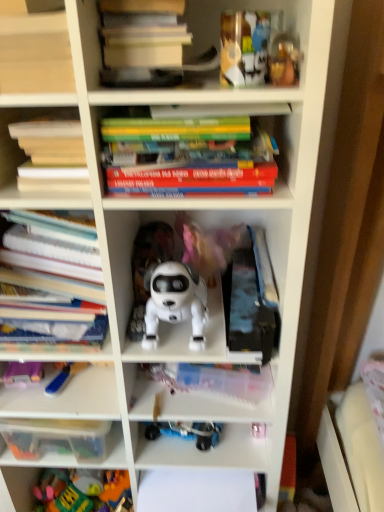
This screenshot has width=384, height=512. Find the location of `hardcover books at upper center, the first book from the top`. hardcover books at upper center, the first book from the top is located at coordinates (142, 42).

What do you see at coordinates (49, 271) in the screenshot? I see `white paper at left, which is the first book in bottom-to-top order` at bounding box center [49, 271].

How much space does white matte robot dog at center, which appears as the 2th toy when viewed from the front, occupy horizontally?

white matte robot dog at center, which appears as the 2th toy when viewed from the front, is 10.27 inches in width.

The image size is (384, 512). Find the location of `clear plastic container at lower left`. clear plastic container at lower left is located at coordinates (66, 398).

Find the location of a particular element. hardcover books at center, the 2th book viewed from the top is located at coordinates (193, 167).

Is clear plastic container at lower left facing towards hardcover books at center, the 2th book viewed from the top?

No, clear plastic container at lower left is not turned towards hardcover books at center, the 2th book viewed from the top.

Are clear plastic container at lower left and hardcover books at center, the 2th book viewed from the top, far apart?

No, clear plastic container at lower left is not far away from hardcover books at center, the 2th book viewed from the top.

From a real-world perspective, relative to hardcover books at center, marked as the third book in a bottom-to-top arrangement, is clear plastic container at lower left vertically above or below?

In terms of real-world spatial position, clear plastic container at lower left is below hardcover books at center, marked as the third book in a bottom-to-top arrangement.

From a real-world perspective, between hardcover books at center, marked as the third book in a bottom-to-top arrangement, and clear plastic container at lower left, who is vertically lower?

clear plastic container at lower left, from a real-world perspective.

Between hardcover books at center, marked as the third book in a bottom-to-top arrangement, and clear plastic container at lower left, which one appears on the right side from the viewer's perspective?

Positioned to the right is hardcover books at center, marked as the third book in a bottom-to-top arrangement.

How far apart are hardcover books at center, the 2th book viewed from the top, and clear plastic container at lower left?

hardcover books at center, the 2th book viewed from the top, is 23.21 inches from clear plastic container at lower left.

Is hardcover books at center, the 2th book viewed from the top, wider than clear plastic container at lower left?

Yes, hardcover books at center, the 2th book viewed from the top, is wider than clear plastic container at lower left.

In terms of size, does matte plastic books at upper left appear bigger or smaller than clear plastic container at lower left?

Clearly, matte plastic books at upper left is smaller in size than clear plastic container at lower left.

Which of these two, matte plastic books at upper left or clear plastic container at lower left, stands taller?

Standing taller between the two is matte plastic books at upper left.

From the picture: Would you consider matte plastic books at upper left to be distant from clear plastic container at lower left?

No.

Is matte plastic books at upper left at the right side of clear plastic container at lower left?

Correct, you'll find matte plastic books at upper left to the right of clear plastic container at lower left.

Considering the sizes of objects hardcover book at upper left, the 2th book positioned from the bottom, and white matte robot dog at center, the second toy positioned from the right, in the image provided, who is smaller, hardcover book at upper left, the 2th book positioned from the bottom, or white matte robot dog at center, the second toy positioned from the right,?

hardcover book at upper left, the 2th book positioned from the bottom, is smaller.

Does point (81, 153) come closer to viewer compared to point (187, 279)?

Yes, point (81, 153) is in front of point (187, 279).

Is matte plastic books at upper left not inside hardcover book at upper left, the third book positioned from the top?

Absolutely, matte plastic books at upper left is external to hardcover book at upper left, the third book positioned from the top.

Is point (19, 41) closer or farther from the camera than point (24, 138)?

Point (19, 41).

Does matte plastic books at upper left have a smaller size compared to hardcover book at upper left, the 2th book positioned from the bottom?

No, matte plastic books at upper left is not smaller than hardcover book at upper left, the 2th book positioned from the bottom.

From a real-world perspective, is matte plastic books at upper left positioned above or below hardcover book at upper left, the 2th book positioned from the bottom?

In terms of real-world spatial position, matte plastic books at upper left is above hardcover book at upper left, the 2th book positioned from the bottom.

Identify the location of cabinet below the white paper at left, arranged as the fourth book when viewed from the top (from the image's perspective). This screenshot has width=384, height=512. (66, 398).

From the image's perspective, is clear plastic container at lower left above or below white paper at left, which is the first book in bottom-to-top order?

Based on their image positions, clear plastic container at lower left is located beneath white paper at left, which is the first book in bottom-to-top order.

From the picture: From a real-world perspective, is clear plastic container at lower left below white paper at left, arranged as the fourth book when viewed from the top?

Indeed, from a real-world perspective, clear plastic container at lower left is positioned beneath white paper at left, arranged as the fourth book when viewed from the top.

From a real-world perspective, relative to hardcover books at center, marked as the third book in a bottom-to-top arrangement, is hardcover book at upper left, the third book positioned from the top, vertically above or below?

In terms of real-world spatial position, hardcover book at upper left, the third book positioned from the top, is below hardcover books at center, marked as the third book in a bottom-to-top arrangement.

Does point (84, 155) appear closer or farther from the camera than point (121, 161)?

Point (84, 155) is closer to the camera than point (121, 161).

Considering the sizes of objects hardcover book at upper left, the third book positioned from the top, and hardcover books at center, marked as the third book in a bottom-to-top arrangement, in the image provided, who is wider, hardcover book at upper left, the third book positioned from the top, or hardcover books at center, marked as the third book in a bottom-to-top arrangement,?

hardcover books at center, marked as the third book in a bottom-to-top arrangement, is wider.

Looking at this image, measure the distance from hardcover book at upper left, the third book positioned from the top, to hardcover books at center, the 2th book viewed from the top.

A distance of 6.18 inches exists between hardcover book at upper left, the third book positioned from the top, and hardcover books at center, the 2th book viewed from the top.

I want to click on the 3rd book in front when counting from the clear plastic container at lower left, so click(x=193, y=167).

The image size is (384, 512). I want to click on cabinet located on the left of hardcover books at center, marked as the third book in a bottom-to-top arrangement, so click(x=66, y=398).

Which object lies nearer to the anchor point metallic gold toy at upper right, acting as the fourth toy starting from the left, hardcover book at upper left, the 2th book positioned from the bottom, or white paper at left, which is the first book in bottom-to-top order?

Among the two, hardcover book at upper left, the 2th book positioned from the bottom, is located nearer to metallic gold toy at upper right, acting as the fourth toy starting from the left.

Consider the image. Looking at the image, which one is located closer to white matte robot dog at center, the 3th toy when ordered from back to front, matte plastic books at upper left or clear plastic container at lower left?

Based on the image, clear plastic container at lower left appears to be nearer to white matte robot dog at center, the 3th toy when ordered from back to front.

Based on their spatial positions, is white matte robot dog at center, the 3th toy when ordered from back to front, or blue plastic toy at lower left, the 1th toy from the left, closer to matte plastic books at upper left?

white matte robot dog at center, the 3th toy when ordered from back to front, lies closer to matte plastic books at upper left than the other object.

When comparing their distances from white paper at left, which is the first book in bottom-to-top order, does hardcover book at upper left, the 2th book positioned from the bottom, or hardcover books at center, marked as the third book in a bottom-to-top arrangement, seem closer?

hardcover book at upper left, the 2th book positioned from the bottom, is closer to white paper at left, which is the first book in bottom-to-top order.

From the image, which object appears to be nearer to hardcover books at center, marked as the third book in a bottom-to-top arrangement, metallic gold toy at upper right, the first toy positioned from the right, or hardcover books at upper center, the first book from the top?

hardcover books at upper center, the first book from the top, lies closer to hardcover books at center, marked as the third book in a bottom-to-top arrangement, than the other object.

Which object lies nearer to the anchor point matte plastic books at upper left, hardcover book at upper left, the third book positioned from the top, or white matte robot dog at center, the second toy positioned from the right?

Among the two, hardcover book at upper left, the third book positioned from the top, is located nearer to matte plastic books at upper left.

Which object lies nearer to the anchor point metallic gold toy at upper right, which is counted as the 1th toy, starting from the top, white paper at left, arranged as the fourth book when viewed from the top, or hardcover books at center, marked as the third book in a bottom-to-top arrangement?

hardcover books at center, marked as the third book in a bottom-to-top arrangement, is positioned closer to the anchor metallic gold toy at upper right, which is counted as the 1th toy, starting from the top.

When comparing their distances from blue plastic toy at lower left, marked as the 2th toy in a bottom-to-top arrangement, does white paper at left, which is the first book in bottom-to-top order, or metallic gold toy at upper right, which is counted as the 1th toy, starting from the top, seem further?

The object further to blue plastic toy at lower left, marked as the 2th toy in a bottom-to-top arrangement, is metallic gold toy at upper right, which is counted as the 1th toy, starting from the top.

I want to click on toy that lies between matte plastic books at upper left and white matte robot dog at center, the second toy positioned from the right, from top to bottom, so click(x=284, y=60).

Where is `book between matte plastic books at upper left and hardcover books at upper center, the fourth book from the bottom`? Image resolution: width=384 pixels, height=512 pixels. book between matte plastic books at upper left and hardcover books at upper center, the fourth book from the bottom is located at coordinates tap(52, 156).

Identify the location of book between hardcover book at upper left, the third book positioned from the top, and plastic colorful toys at lower left, which appears as the 3th toy when viewed from the right, vertically. Image resolution: width=384 pixels, height=512 pixels. (49, 271).

The width and height of the screenshot is (384, 512). Find the location of `shelf between hardcover books at upper center, the first book from the top, and white matte robot dog at center, the 3th toy when ordered from back to front, in the up-down direction`. shelf between hardcover books at upper center, the first book from the top, and white matte robot dog at center, the 3th toy when ordered from back to front, in the up-down direction is located at coordinates (35, 54).